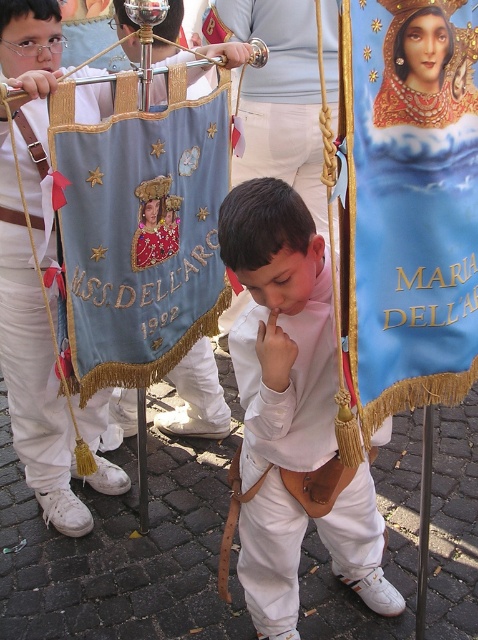
You are a photographer trying to capture the boy in the scene. You notice the white leather belt at center and the light blue fabric banner at left. Which object should you focus on first if you want to take a clear photo of the closer item?

The white leather belt at center is closer to the viewer than the light blue fabric banner at left, so you should focus on the white leather belt at center first to ensure it is in clear focus.

You are a photographer trying to capture both the blue fabric banner at center and the light blue fabric banner at left in a single frame. Based on their sizes, which banner should you focus on to ensure both fit in the photo?

Since the blue fabric banner at center is shorter than the light blue fabric banner at left, you should focus on the light blue fabric banner at left to ensure both banners fit in the photo as it is taller and will require more space.